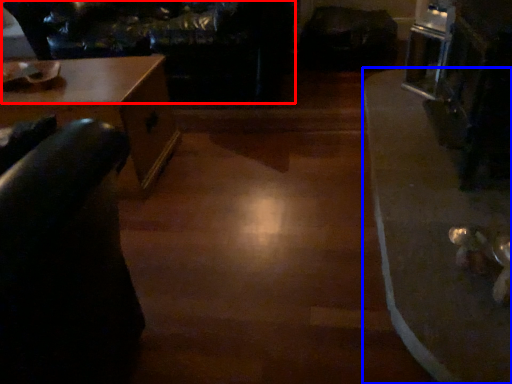
Question: Which of the following is the closest to the observer, couch (highlighted by a red box) or table (highlighted by a blue box)?

Choices:
 (A) couch
 (B) table

Answer: (B)